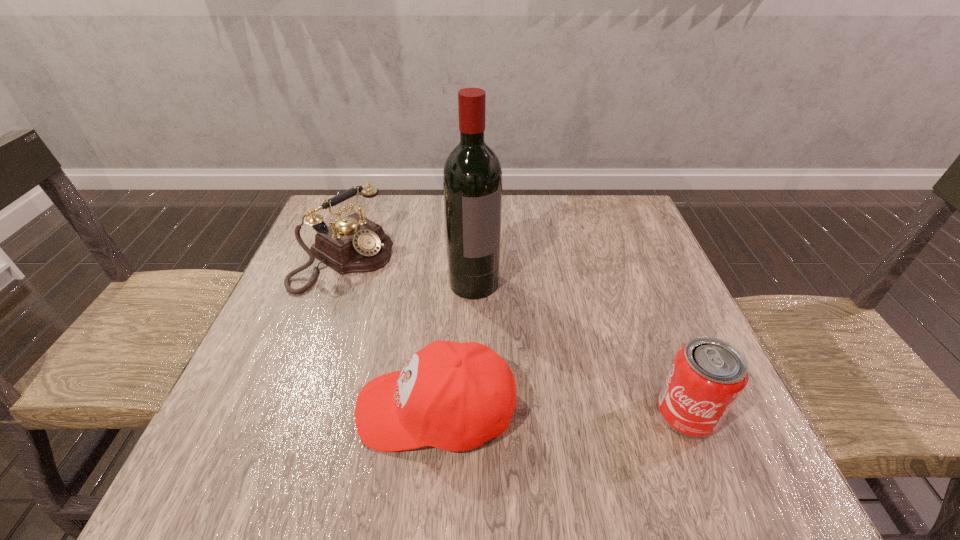
Identify the location of free spot on the desktop that is between the baseball cap and the can and is positioned on the label of the tallest object. This screenshot has height=540, width=960. (564, 411).

Identify the location of vacant spot on the desktop that is between the baseball cap and the can and is positioned on the dial of the telephone. (590, 411).